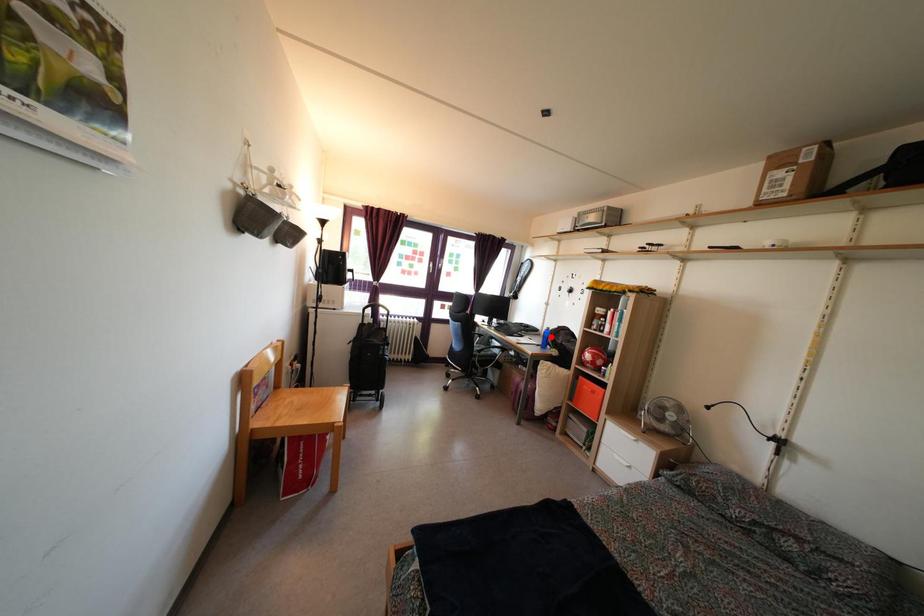
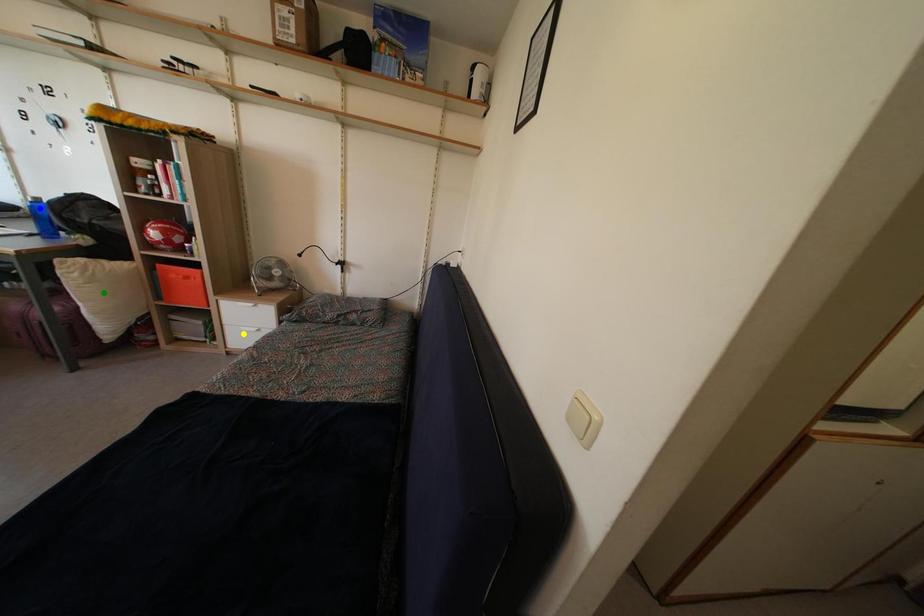
Question: I am providing you with two images of the same scene from different viewpoints. A red point is marked on the first image. You are given multiple points on the second image. Which point in image 2 represents the same 3d spot as the red point in image 1?

Choices:
 (A) blue point
 (B) yellow point
 (C) green point

Answer: (A)